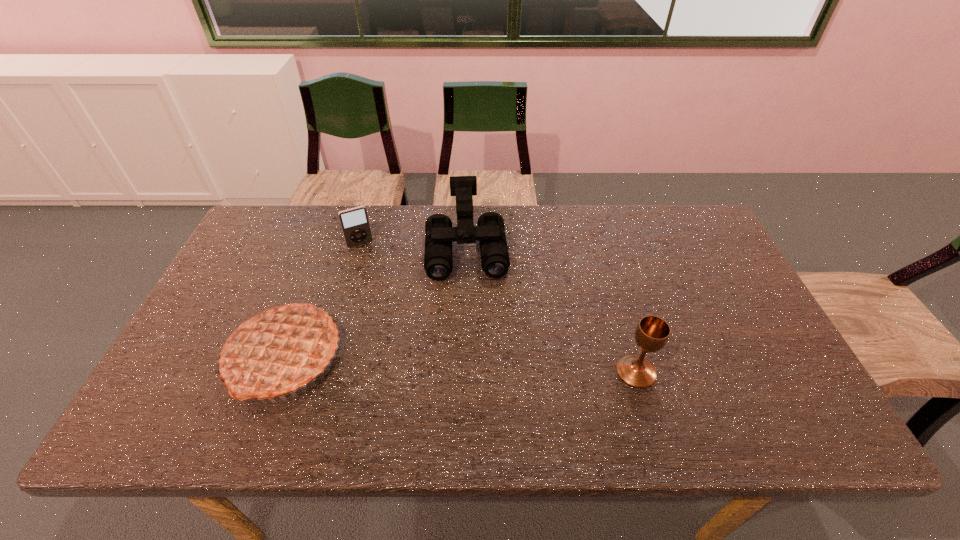
Where is `vacant area situated 0.350m on the front lenses of the binoculars`? This screenshot has width=960, height=540. vacant area situated 0.350m on the front lenses of the binoculars is located at coordinates (473, 392).

Identify the location of vacant space located 0.350m on the front lenses of the binoculars. The width and height of the screenshot is (960, 540). (473, 392).

This screenshot has width=960, height=540. Find the location of `iPod that is positioned at the far edge`. iPod that is positioned at the far edge is located at coordinates (354, 222).

You are a GUI agent. You are given a task and a screenshot of the screen. Output one action in this format:
    pyautogui.click(x=<x>, y=<y>)
    Task: Click on the binoculars positioned at the far edge
    
    Given the screenshot: What is the action you would take?
    pyautogui.click(x=490, y=231)

Where is `pie located in the near edge section of the desktop`? The height and width of the screenshot is (540, 960). pie located in the near edge section of the desktop is located at coordinates (278, 349).

I want to click on chalice present at the near edge, so click(652, 333).

The image size is (960, 540). Identify the location of object positioned at the left edge. (278, 349).

Where is `object that is at the near left corner`? The image size is (960, 540). object that is at the near left corner is located at coordinates (278, 349).

At what (x,y) coordinates should I click in order to perform the action: click on free region at the far edge. Please return your answer as a coordinate pair (x, y). Looking at the image, I should click on (x=540, y=243).

Locate an element on the screen. The width and height of the screenshot is (960, 540). vacant space at the near edge is located at coordinates (596, 373).